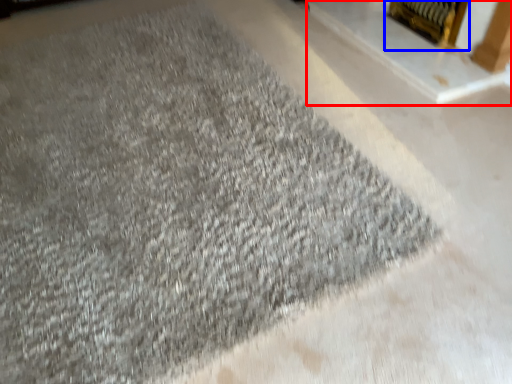
Question: Among these objects, which one is nearest to the camera, fireplace (highlighted by a red box) or fireplace (highlighted by a blue box)?

Choices:
 (A) fireplace
 (B) fireplace

Answer: (A)